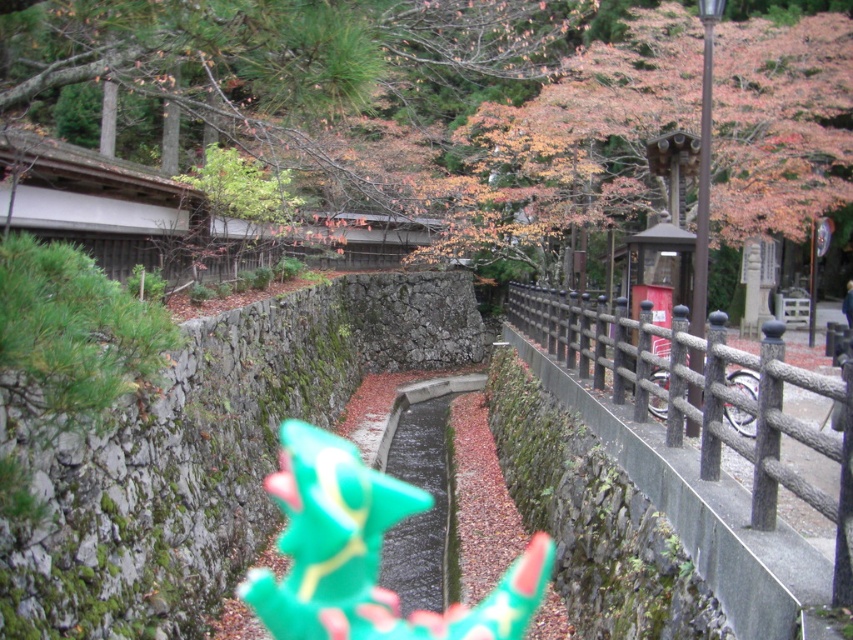
Question: Considering the relative positions of autumn leaves at upper center and green plastic toy at center in the image provided, where is autumn leaves at upper center located with respect to green plastic toy at center?

Choices:
 (A) left
 (B) right

Answer: (B)

Question: Can you confirm if autumn leaves at upper center is positioned to the left of smooth gray fence at center right?

Choices:
 (A) yes
 (B) no

Answer: (A)

Question: Is autumn leaves at upper center positioned at the back of green plastic toy at center?

Choices:
 (A) yes
 (B) no

Answer: (B)

Question: Considering the real-world distances, which object is closest to the green plastic toy at center?

Choices:
 (A) smooth gray fence at center right
 (B) autumn leaves at upper center

Answer: (A)

Question: Considering the real-world distances, which object is closest to the autumn leaves at upper center?

Choices:
 (A) green plastic toy at center
 (B) smooth gray fence at center right

Answer: (B)

Question: Which point is farther to the camera?

Choices:
 (A) smooth gray fence at center right
 (B) green plastic toy at center
 (C) autumn leaves at upper center

Answer: (B)